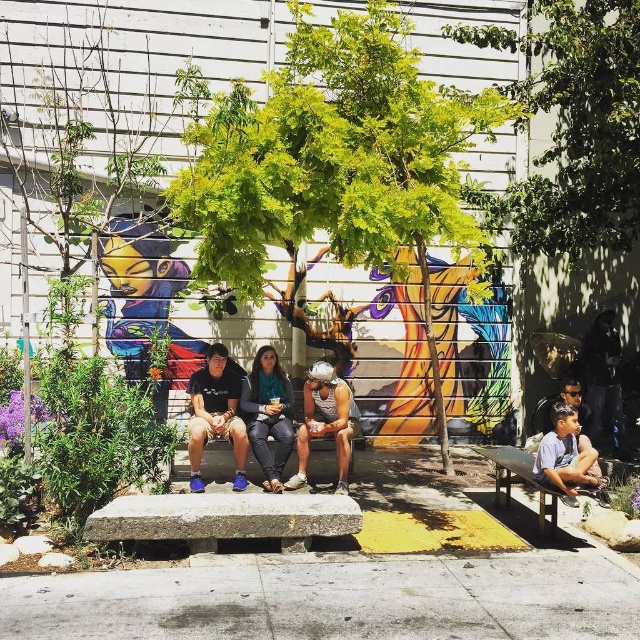
Question: Based on their relative distances, which object is farther from the dark blue jeans at center?

Choices:
 (A) concrete bench at center
 (B) black matte jacket at right
 (C) wooden bench at lower right

Answer: (B)

Question: Does dark blue t-shirt at center appear on the right side of concrete bench at center?

Choices:
 (A) no
 (B) yes

Answer: (B)

Question: Does metallic silver helmet at center appear over wooden bench at lower right?

Choices:
 (A) yes
 (B) no

Answer: (A)

Question: Which of the following is the farthest from the observer?

Choices:
 (A) (616, 435)
 (B) (275, 356)
 (C) (228, 384)
 (D) (300, 486)

Answer: (A)

Question: Is metallic silver helmet at center below black matte jacket at right?

Choices:
 (A) no
 (B) yes

Answer: (B)

Question: Which is farther from the matte black sunglasses at lower right?

Choices:
 (A) wooden bench at lower right
 (B) light blue denim shorts at lower right
 (C) metallic silver helmet at center
 (D) dark blue t-shirt at center

Answer: (D)